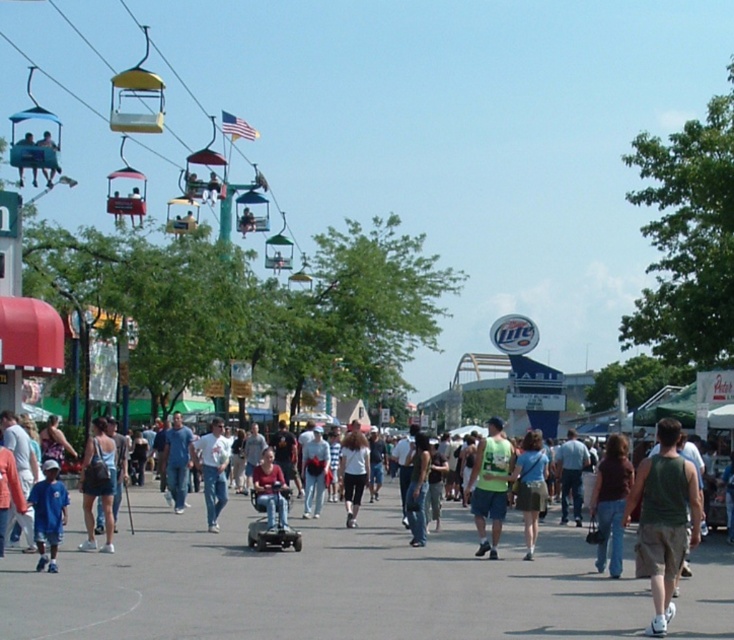
Question: Is denim skirt at center bigger than matte black helmet at upper left?

Choices:
 (A) no
 (B) yes

Answer: (B)

Question: Which of the following is the farthest from the observer?

Choices:
 (A) white cotton shirt at center
 (B) denim jeans at center
 (C) denim skirt at center

Answer: (A)

Question: Which point is farther to the camera?

Choices:
 (A) (650, 496)
 (B) (214, 499)

Answer: (B)

Question: Does green sleeveless shirt at center appear on the left side of metallic blue chair at upper left?

Choices:
 (A) no
 (B) yes

Answer: (A)

Question: Is denim jeans at center positioned before blue cotton shirt at lower left?

Choices:
 (A) no
 (B) yes

Answer: (A)

Question: Which point appears farthest from the camera in this image?

Choices:
 (A) (619, 449)
 (B) (103, 461)
 (C) (534, 538)
 (D) (269, 490)

Answer: (D)